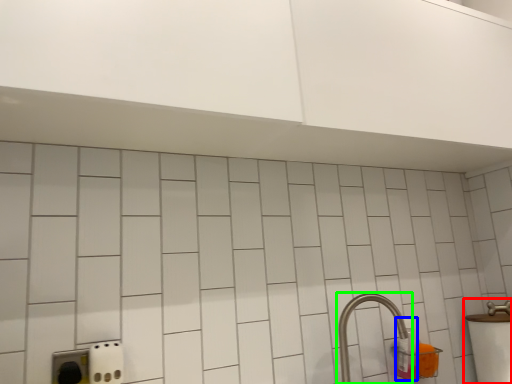
Question: Considering the real-world distances, which object is closest to sink (highlighted by a red box)? bottle (highlighted by a blue box) or tap (highlighted by a green box).

Choices:
 (A) bottle
 (B) tap

Answer: (A)